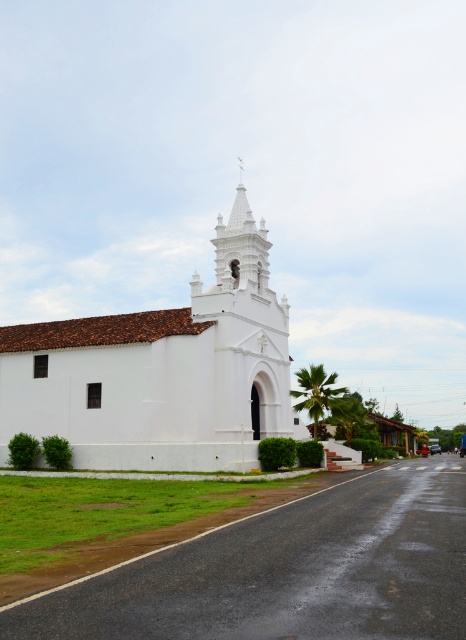
Based on the photo, you are standing at the entrance of a park and see the white matte church at center. If you walk straight ahead, will you move towards the church or away from it?

Since the white matte church at center is positioned at point (163,371), walking straight ahead from the park entrance would move you towards the church as it is centrally located in the image.

You are a photographer planning to capture the white matte church at center and the white stucco spire at upper center in a single shot. Based on their positions, which one do you think will appear wider in the photo?

The white matte church at center might appear wider in the photo than the white stucco spire at upper center because the white matte church at center is wider.

You are standing on the paved road in front of the white matte church at center and want to take a photo of the white stucco spire at upper center. Which object will appear taller in the photo?

The white stucco spire at upper center will appear taller in the photo because it is taller than the white matte church at center.